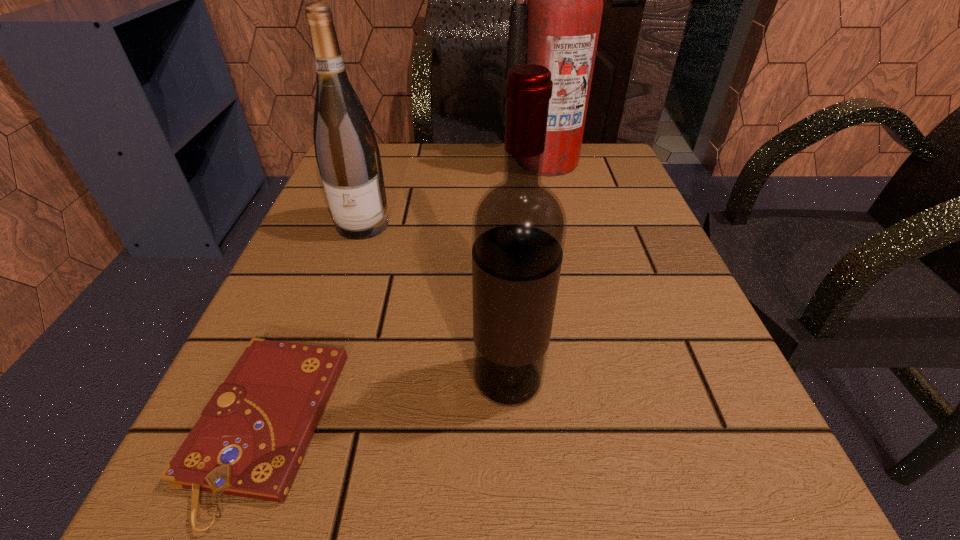
You are a GUI agent. You are given a task and a screenshot of the screen. Output one action in this format:
    pyautogui.click(x=<x>, y=<y>)
    Task: Click on the farthest object
    The image size is (960, 540).
    Given the screenshot: What is the action you would take?
    pyautogui.click(x=558, y=28)

The height and width of the screenshot is (540, 960). In order to click on fire extinguisher in this screenshot , I will do `click(558, 28)`.

Image resolution: width=960 pixels, height=540 pixels. I want to click on the right wine bottle, so click(519, 225).

You are a GUI agent. You are given a task and a screenshot of the screen. Output one action in this format:
    pyautogui.click(x=<x>, y=<y>)
    Task: Click on the farther wine bottle
    
    Given the screenshot: What is the action you would take?
    pyautogui.click(x=347, y=153)

Locate an element on the screen. This screenshot has height=540, width=960. the third nearest object is located at coordinates (347, 153).

The height and width of the screenshot is (540, 960). Identify the location of the shortest object. (250, 441).

Image resolution: width=960 pixels, height=540 pixels. Find the location of `free point located 0.260m on the front of the farthest object near the operation label`. free point located 0.260m on the front of the farthest object near the operation label is located at coordinates (568, 255).

The image size is (960, 540). I want to click on vacant space situated on the right of the nearer wine bottle, so click(678, 380).

The height and width of the screenshot is (540, 960). What are the coordinates of `free spot located 0.390m on the label of the farther wine bottle` in the screenshot? It's located at click(x=282, y=460).

What are the coordinates of `vacant space situated 0.190m on the right of the shortest object` in the screenshot? It's located at (496, 427).